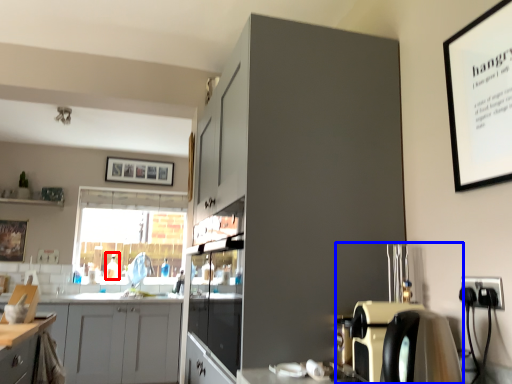
Question: Which object is further to the camera taking this photo, bottle (highlighted by a red box) or coffee machine (highlighted by a blue box)?

Choices:
 (A) bottle
 (B) coffee machine

Answer: (A)